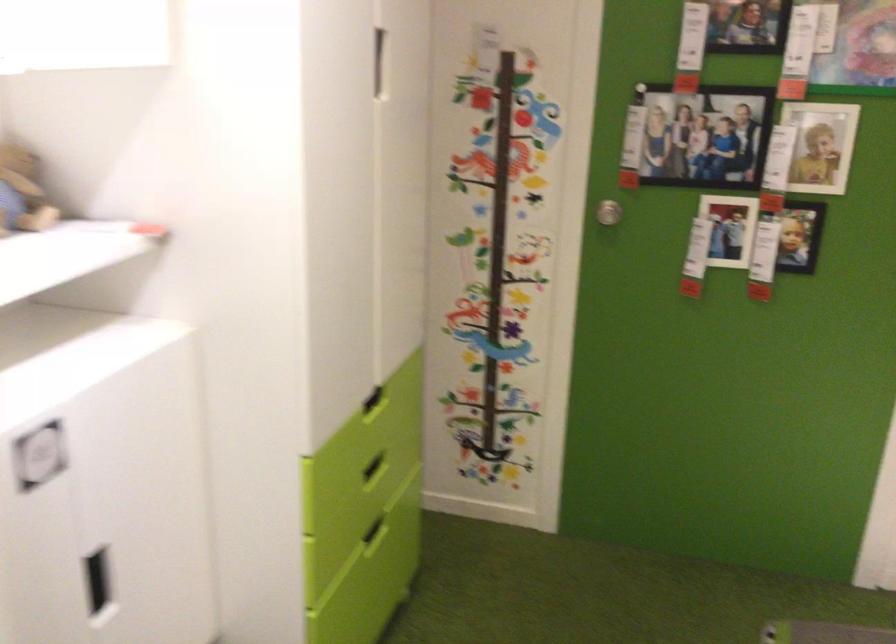
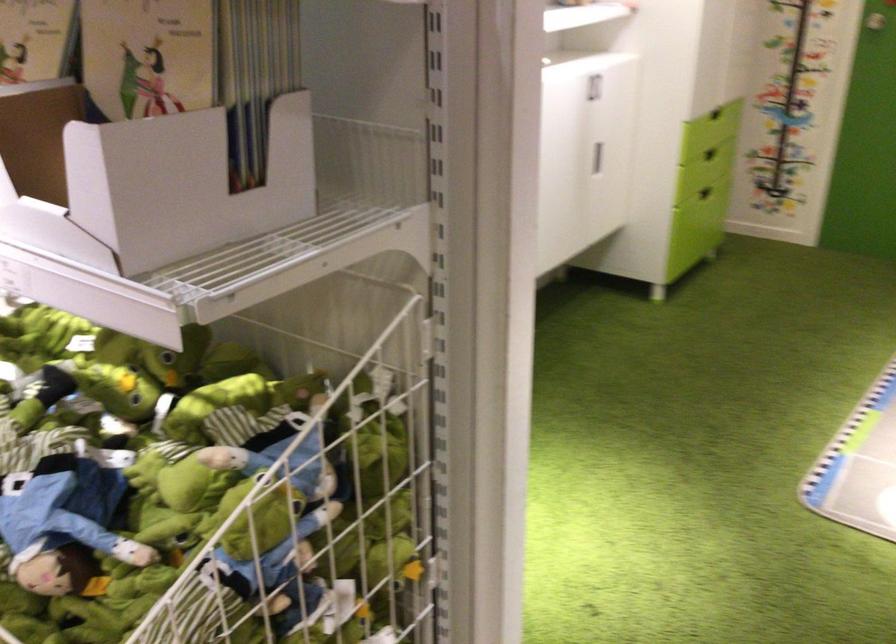
Locate, in the second image, the point that corresponds to [357,538] in the first image.

(704, 193)